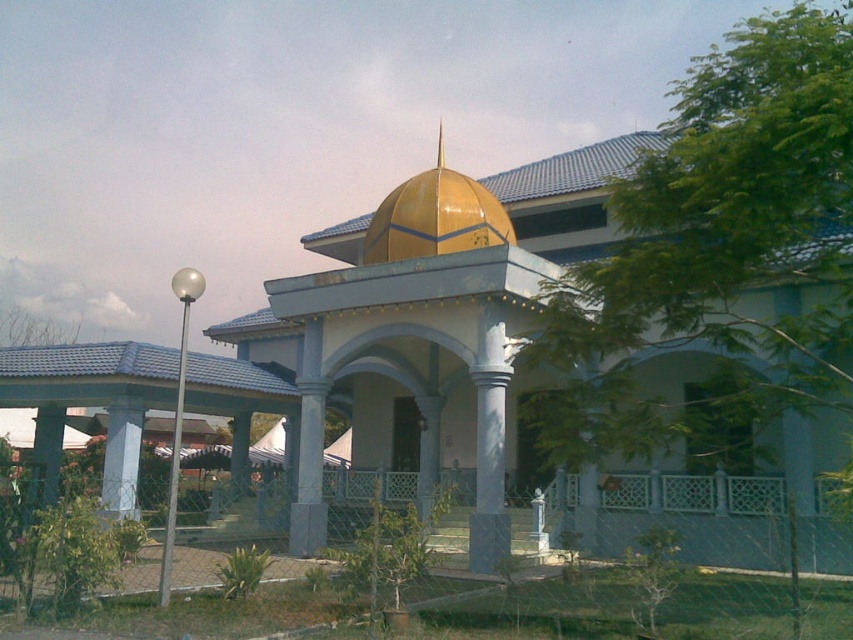
Can you confirm if matte blue mosque at center is shorter than gold polished dome at center?

Yes, matte blue mosque at center is shorter than gold polished dome at center.

Locate an element on the screen. matte blue mosque at center is located at coordinates click(x=415, y=317).

I want to click on matte blue mosque at center, so pyautogui.click(x=415, y=317).

Does gold polished dome at center have a greater height compared to smooth concrete pillar at center?

Indeed, gold polished dome at center has a greater height compared to smooth concrete pillar at center.

Which is more to the right, gold polished dome at center or smooth concrete pillar at center?

gold polished dome at center is more to the right.

The height and width of the screenshot is (640, 853). I want to click on gold polished dome at center, so click(408, 342).

Which is more to the right, white concrete pillar at center or smooth concrete pillar at center?

white concrete pillar at center

Between white concrete pillar at center and smooth concrete pillar at center, which one appears on the left side from the viewer's perspective?

Positioned to the left is smooth concrete pillar at center.

Where is `white concrete pillar at center`? The height and width of the screenshot is (640, 853). white concrete pillar at center is located at coordinates (120, 456).